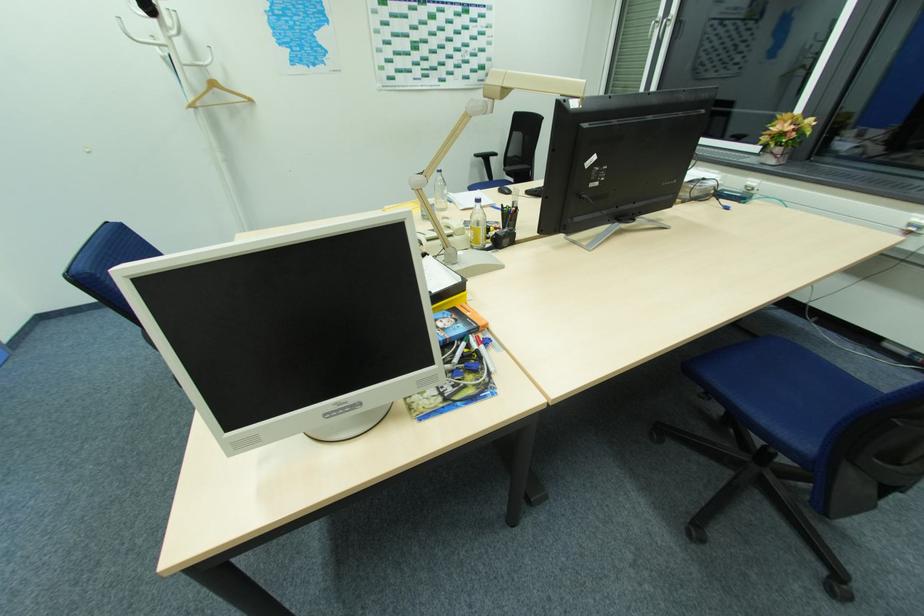
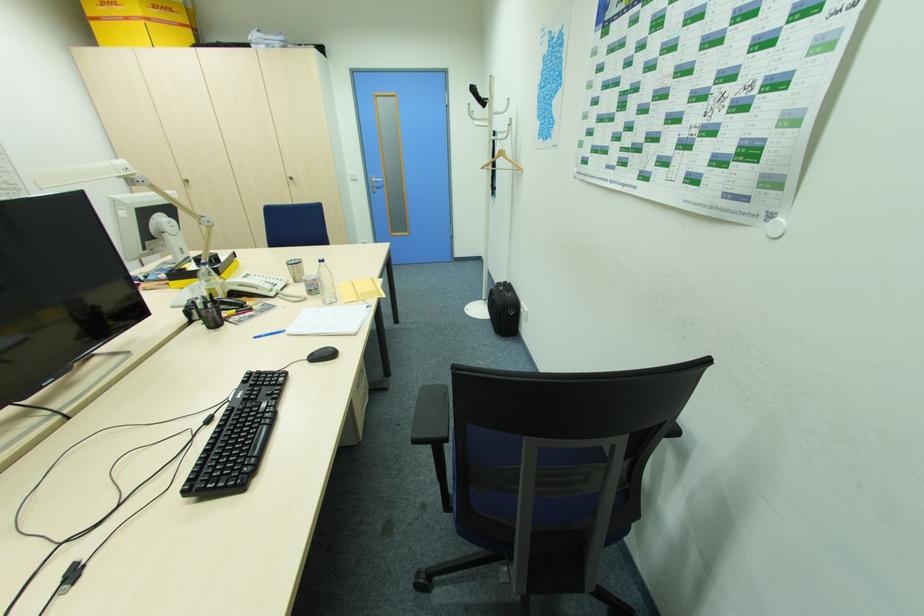
Locate, in the second image, the point that corresponds to the point at 442,174 in the first image.

(324, 264)